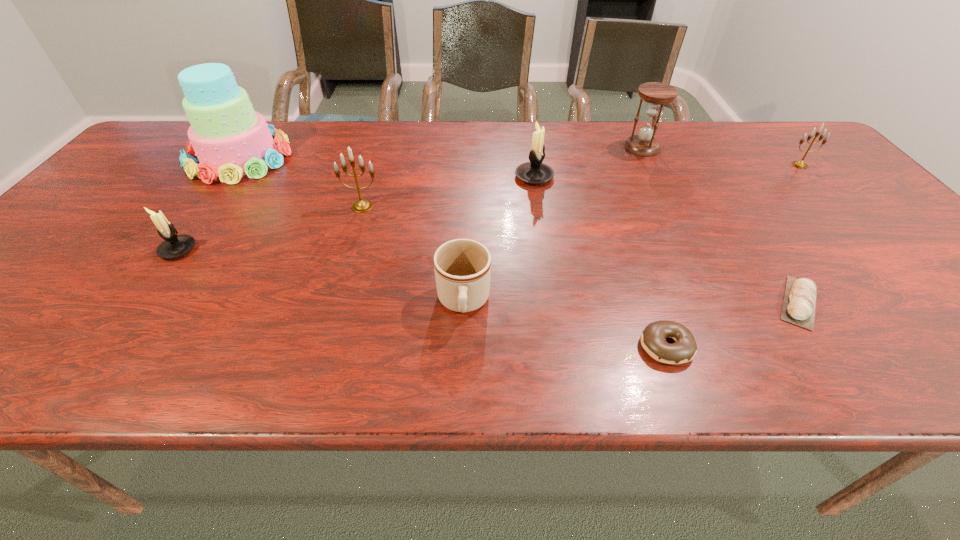
Image resolution: width=960 pixels, height=540 pixels. Identify the location of vacant space that's between the nearest candelabrum and the blue cake. (208, 204).

Identify the location of free space between the rightmost candelabrum and the third farthest candelabrum. The image size is (960, 540). click(581, 186).

Where is `free space between the farther gold candelabrum and the pita bread`? This screenshot has height=540, width=960. free space between the farther gold candelabrum and the pita bread is located at coordinates (800, 234).

Locate an element on the screen. Image resolution: width=960 pixels, height=540 pixels. vacant area that lies between the eighth object from left to right and the cake is located at coordinates (519, 230).

The width and height of the screenshot is (960, 540). What are the coordinates of `vacant space in between the mug and the third farthest candelabrum` in the screenshot? It's located at (413, 254).

The image size is (960, 540). I want to click on free space between the right gold candelabrum and the sixth object from right to left, so click(632, 234).

At what (x,y) coordinates should I click in order to perform the action: click on free space between the hourglass and the bigger white candle holder. Please return your answer as a coordinate pair (x, y). The image size is (960, 540). Looking at the image, I should click on (588, 163).

Locate which object is the third closest to the rightmost object. Please provide its 2D coordinates. Your answer should be formatted as a tuple, i.e. [(x, y)], where the tuple contains the x and y coordinates of a point satisfying the conditions above.

[(534, 172)]

Locate which object is the sixth closest to the hourglass. Please provide its 2D coordinates. Your answer should be formatted as a tuple, i.e. [(x, y)], where the tuple contains the x and y coordinates of a point satisfying the conditions above.

[(362, 205)]

Identify the location of the second closest candelabrum to the hourglass. (799, 164).